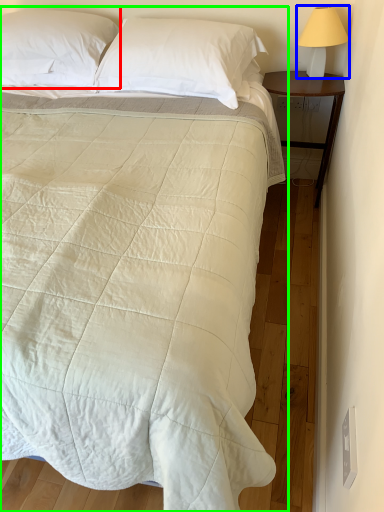
Question: Considering the real-world distances, which object is farthest from pillow (highlighted by a red box)? bedside lamp (highlighted by a blue box) or bed (highlighted by a green box)?

Choices:
 (A) bedside lamp
 (B) bed

Answer: (A)